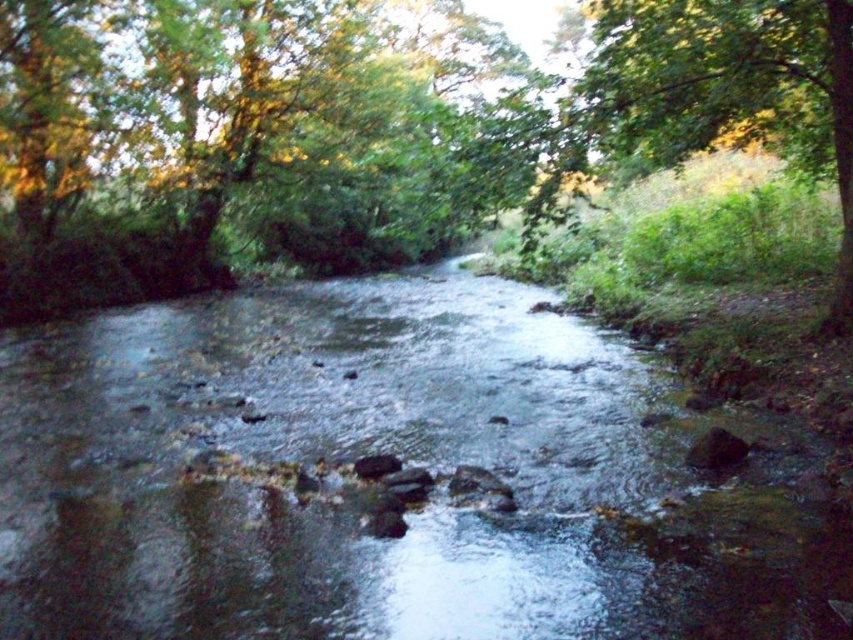
You are a hiker who wants to cross the stream. You see the clear water at center and the green leafy tree at center. Which object is directly above the other? Please answer with the object that is above.

The green leafy tree at center is directly above the clear water at center.

You are a hiker who wants to cross the stream. You see the clear water at center and the green leafy tree at center. Which object is closer to your current position if you are standing on the left bank?

The clear water at center is positioned on the left side of green leafy tree at center, so the clear water at center is closer to your current position on the left bank.